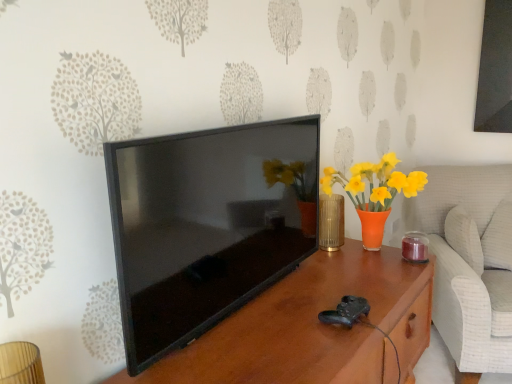
Question: Is gold textured vase at center behind white textured swivel chair at right?

Choices:
 (A) no
 (B) yes

Answer: (B)

Question: Is gold textured vase at center at the left side of white textured swivel chair at right?

Choices:
 (A) no
 (B) yes

Answer: (B)

Question: From the image's perspective, is gold textured vase at center beneath white textured swivel chair at right?

Choices:
 (A) no
 (B) yes

Answer: (A)

Question: Is gold textured vase at center beside white textured swivel chair at right?

Choices:
 (A) no
 (B) yes

Answer: (A)

Question: From a real-world perspective, does gold textured vase at center stand above white textured swivel chair at right?

Choices:
 (A) yes
 (B) no

Answer: (A)

Question: Is point (322, 292) closer or farther from the camera than point (329, 233)?

Choices:
 (A) closer
 (B) farther

Answer: (A)

Question: Is brown wood table at center in front of or behind gold textured vase at center in the image?

Choices:
 (A) behind
 (B) front

Answer: (B)

Question: Would you say brown wood table at center is to the left or to the right of gold textured vase at center in the picture?

Choices:
 (A) right
 (B) left

Answer: (B)

Question: From a real-world perspective, is brown wood table at center positioned above or below gold textured vase at center?

Choices:
 (A) above
 (B) below

Answer: (B)

Question: From the image's perspective, is white textured swivel chair at right above or below gold textured vase at center?

Choices:
 (A) above
 (B) below

Answer: (B)

Question: From a real-world perspective, relative to gold textured vase at center, is white textured swivel chair at right vertically above or below?

Choices:
 (A) above
 (B) below

Answer: (B)

Question: Is point coord(448,291) closer or farther from the camera than point coord(343,220)?

Choices:
 (A) farther
 (B) closer

Answer: (A)

Question: Considering the positions of white textured swivel chair at right and gold textured vase at center in the image, is white textured swivel chair at right wider or thinner than gold textured vase at center?

Choices:
 (A) wide
 (B) thin

Answer: (A)

Question: From the image's perspective, relative to black glossy tv at center, is white textured swivel chair at right above or below?

Choices:
 (A) above
 (B) below

Answer: (B)

Question: Is white textured swivel chair at right inside or outside of black glossy tv at center?

Choices:
 (A) outside
 (B) inside

Answer: (A)